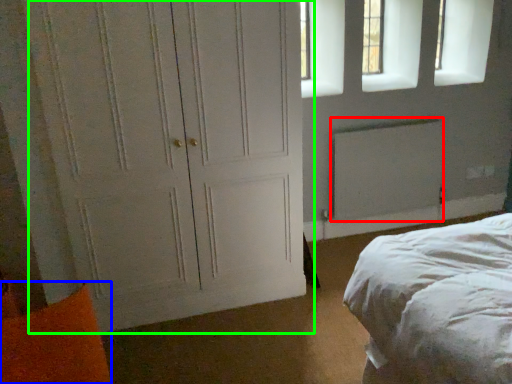
Question: Estimate the real-world distances between objects in this image. Which object is closer to radiator (highlighted by a red box), pillow (highlighted by a blue box) or door (highlighted by a green box)?

Choices:
 (A) pillow
 (B) door

Answer: (B)